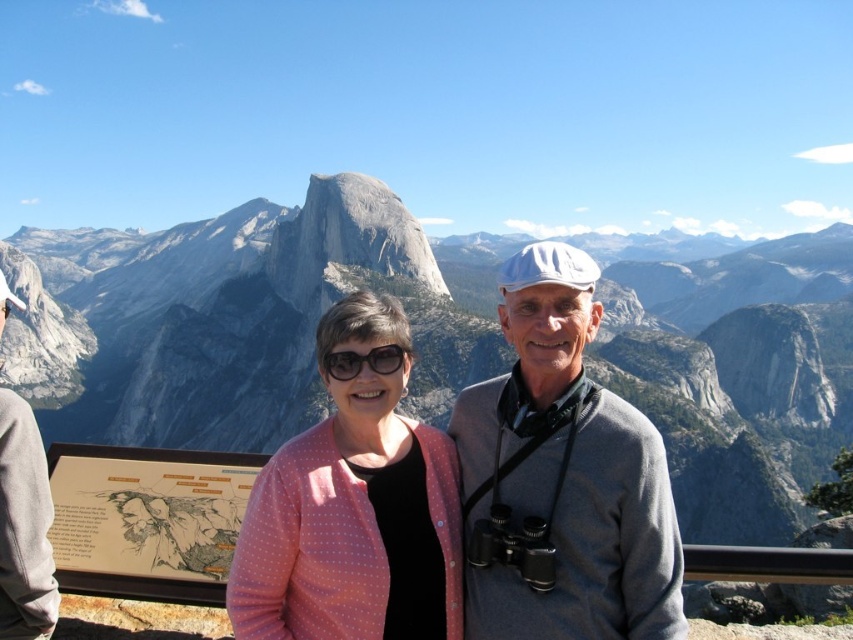
You are standing at the viewpoint in Yosemite National Park and want to take a photo of two points in the scene. The first point is at coordinate point(280, 508) and the second is at point(338, 220). Which point is closer to you?

Point(280, 508) is closer to the viewer than point(338, 220).

You are standing at the viewpoint in Yosemite National Park and see two points marked in the scene. Which of the two points, point [544,428] or point [364,362], is closer to you?

Point [544,428] is closer to the viewer than point [364,362].